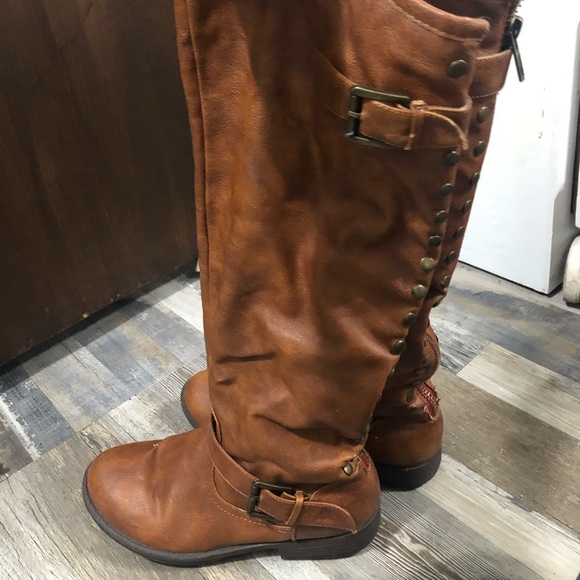
You are a GUI agent. You are given a task and a screenshot of the screen. Output one action in this format:
    pyautogui.click(x=<x>, y=<y>)
    Task: Click on the floor
    The image size is (580, 580).
    Given the screenshot: What is the action you would take?
    pyautogui.click(x=516, y=491)